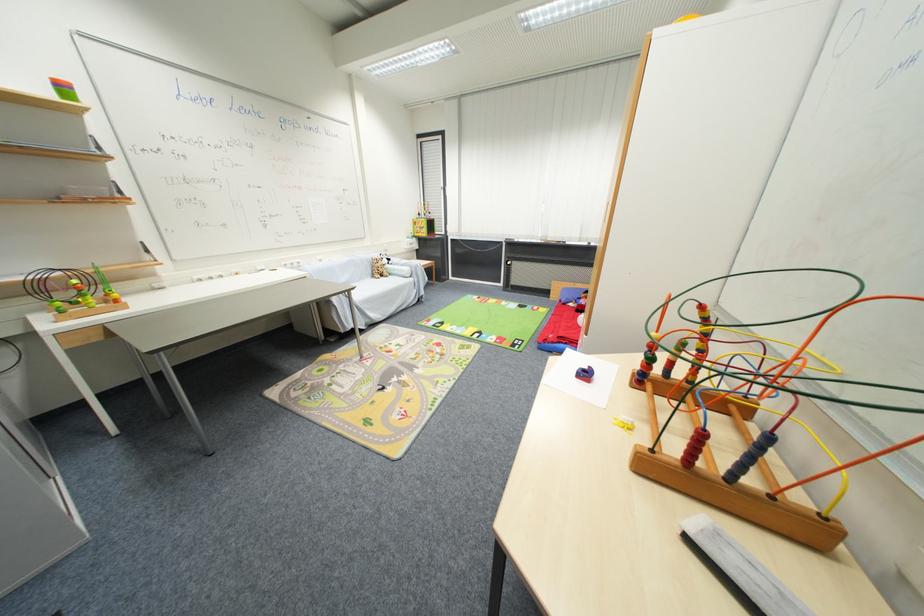
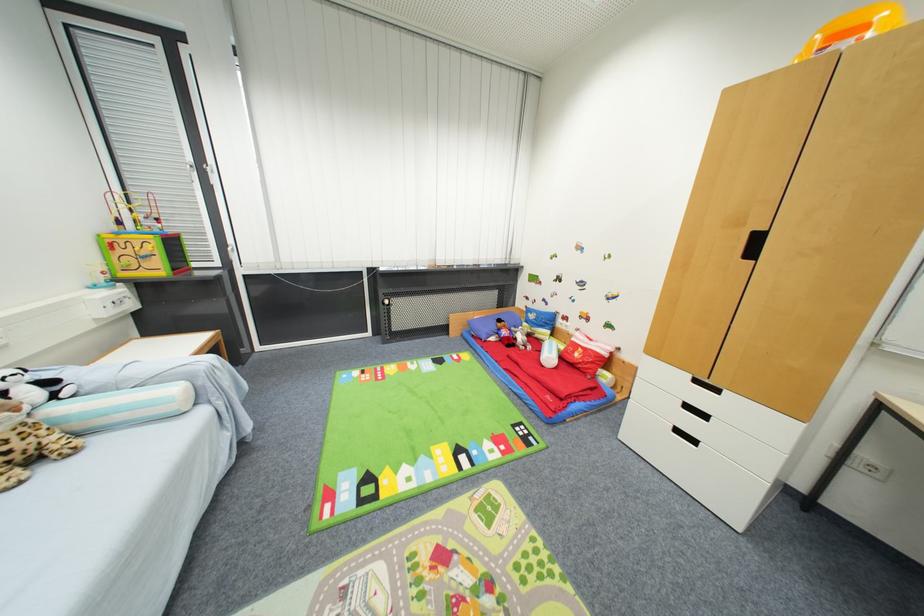
The point at (394, 261) is marked in the first image. Where is the corresponding point in the second image?

(54, 384)